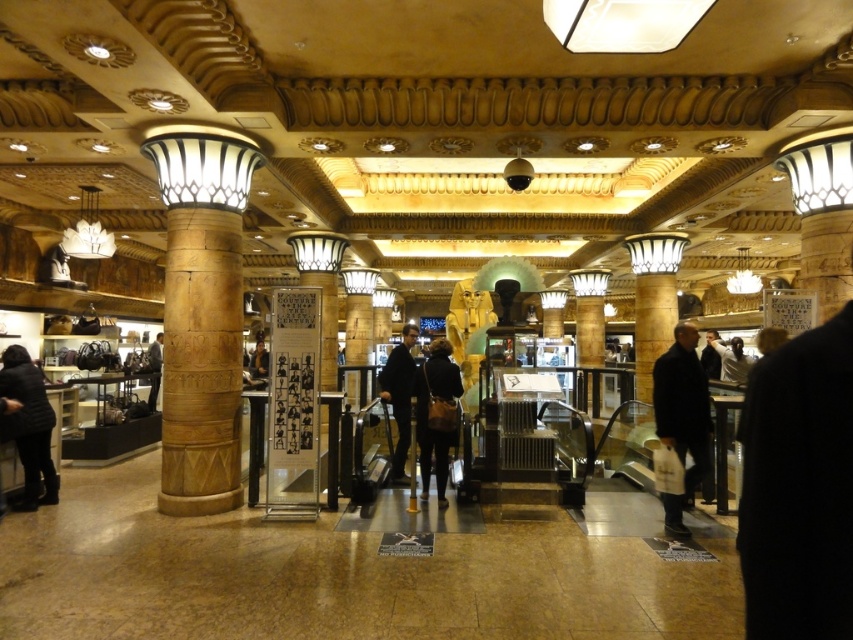
Who is lower down, dark gray fabric coat at right or dark brown leather bag at center?

Positioned lower is dark brown leather bag at center.

Is dark gray fabric coat at right bigger than dark brown leather bag at center?

Yes, dark gray fabric coat at right is bigger than dark brown leather bag at center.

In order to click on dark gray fabric coat at right in this screenshot , I will do `click(682, 417)`.

Where is `dark gray fabric coat at right`? This screenshot has height=640, width=853. dark gray fabric coat at right is located at coordinates (682, 417).

Which of these two, gold polished pillar at center or dark brown leather jacket at center, stands taller?

gold polished pillar at center

Is gold polished pillar at center to the right of dark brown leather jacket at center from the viewer's perspective?

Yes, gold polished pillar at center is to the right of dark brown leather jacket at center.

You are a GUI agent. You are given a task and a screenshot of the screen. Output one action in this format:
    pyautogui.click(x=<x>, y=<y>)
    Task: Click on the gold polished pillar at center
    
    Given the screenshot: What is the action you would take?
    pyautogui.click(x=322, y=289)

Does wooden column at left have a smaller size compared to dark gray fabric coat at right?

Actually, wooden column at left might be larger than dark gray fabric coat at right.

Does wooden column at left have a lesser width compared to dark gray fabric coat at right?

No, wooden column at left is not thinner than dark gray fabric coat at right.

This screenshot has height=640, width=853. In order to click on wooden column at left in this screenshot , I will do `click(201, 312)`.